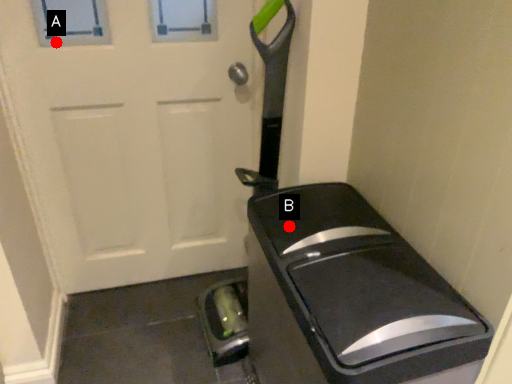
Question: Two points are circled on the image, labeled by A and B beside each circle. Which point is farther from the camera taking this photo?

Choices:
 (A) A is further
 (B) B is further

Answer: (A)